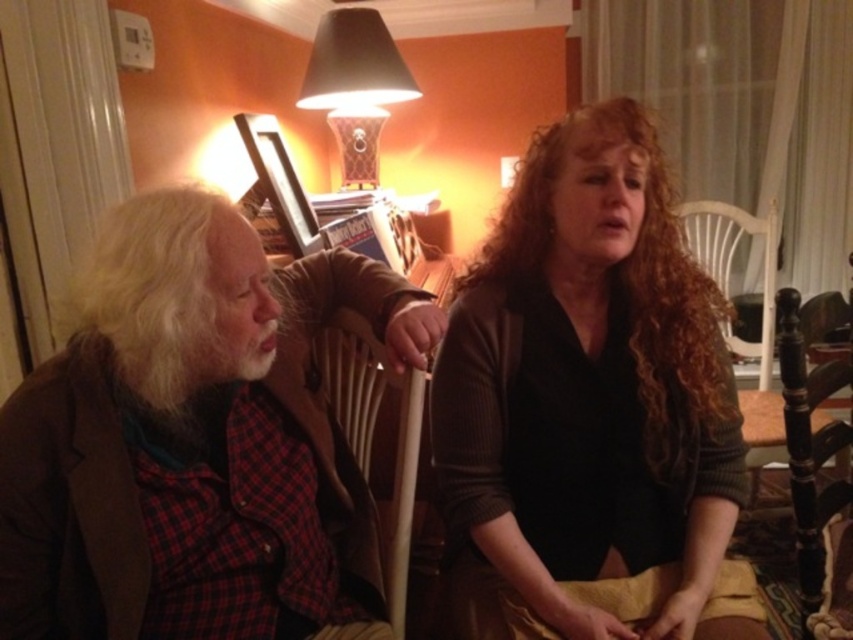
Does dark brown sweater at center have a larger size compared to matte black lampshade at upper center?

Yes, dark brown sweater at center is bigger than matte black lampshade at upper center.

Is dark brown sweater at center behind matte black lampshade at upper center?

No, it is in front of matte black lampshade at upper center.

Who is more distant from viewer, (648, 285) or (395, 92)?

The point (395, 92) is more distant.

Locate an element on the screen. Image resolution: width=853 pixels, height=640 pixels. dark brown sweater at center is located at coordinates (585, 390).

Is plaid fabric shirt at left above dark brown sweater at center?

No.

Between point (170, 204) and point (480, 552), which one is positioned behind?

Positioned behind is point (480, 552).

Find the location of a particular element. plaid fabric shirt at left is located at coordinates (189, 435).

Image resolution: width=853 pixels, height=640 pixels. I want to click on plaid fabric shirt at left, so click(189, 435).

Who is more forward, (97, 291) or (335, 317)?

Point (97, 291) is more forward.

Between plaid fabric shirt at left and wooden chair at center, which one has less height?

wooden chair at center

The image size is (853, 640). What do you see at coordinates (189, 435) in the screenshot?
I see `plaid fabric shirt at left` at bounding box center [189, 435].

What are the coordinates of `plaid fabric shirt at left` in the screenshot? It's located at (189, 435).